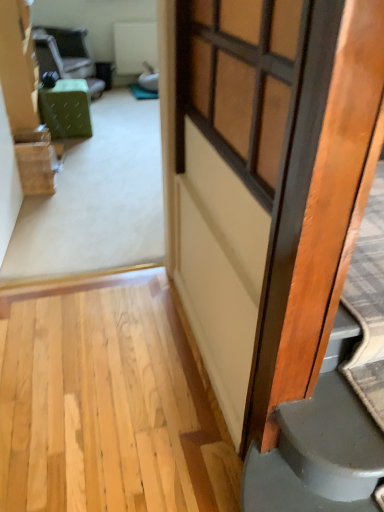
Question: Is point (238, 364) positioned closer to the camera than point (92, 73)?

Choices:
 (A) closer
 (B) farther

Answer: (A)

Question: From the image's perspective, relative to green fabric chair at upper left, is wooden door at right above or below?

Choices:
 (A) below
 (B) above

Answer: (A)

Question: Which object is positioned farthest from the wooden door at right?

Choices:
 (A) wooden door at right
 (B) green fabric ottoman at center
 (C) matte wooden window at center
 (D) green fabric chair at upper left

Answer: (D)

Question: Which is nearer to the green fabric ottoman at center?

Choices:
 (A) green fabric chair at upper left
 (B) matte wooden window at center
 (C) wooden door at right
 (D) wooden door at right

Answer: (A)